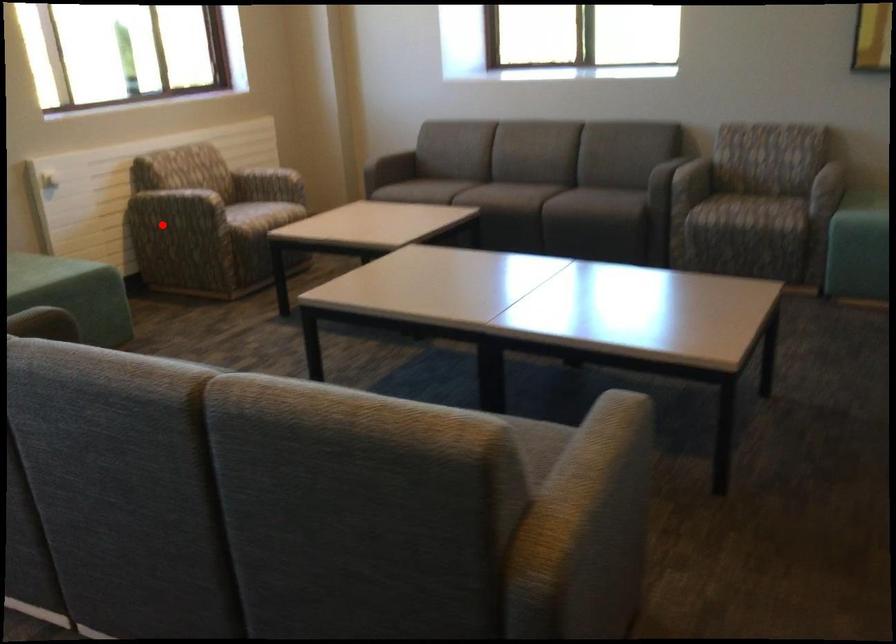
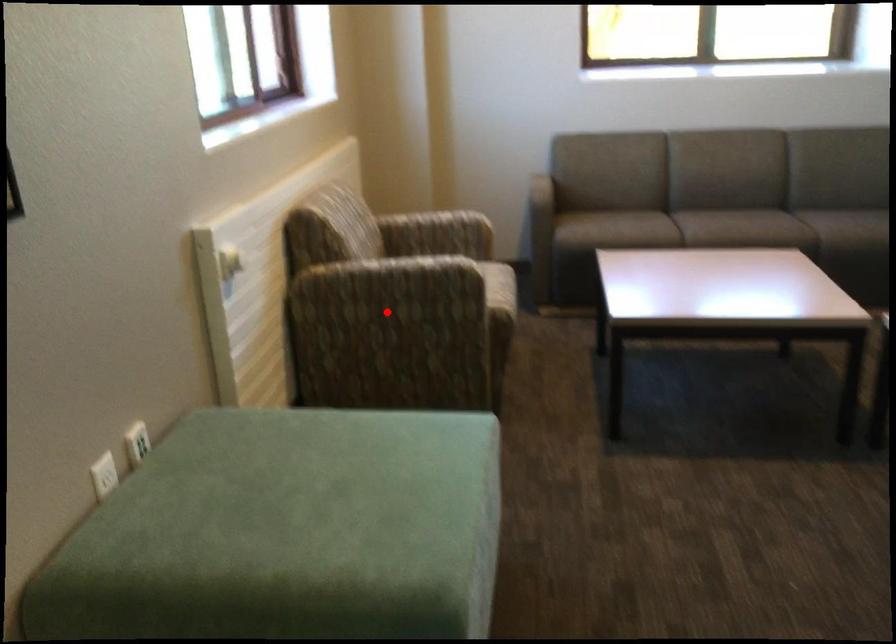
I am providing you with two images of the same scene from different viewpoints. A red point is marked on the first image and another point is marked on the second image. Are the points marked in image1 and image2 representing the same 3D position?

Yes